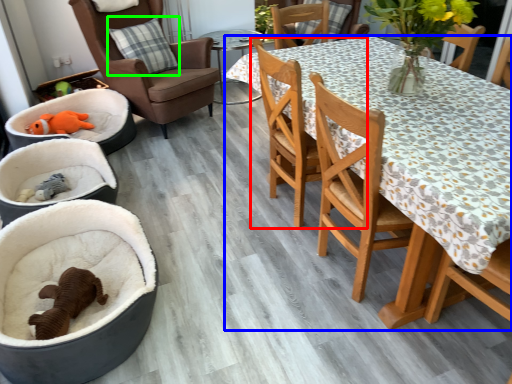
Question: Considering the real-world distances, which object is closest to chair (highlighted by a red box)? desk (highlighted by a blue box) or pillow (highlighted by a green box).

Choices:
 (A) desk
 (B) pillow

Answer: (A)